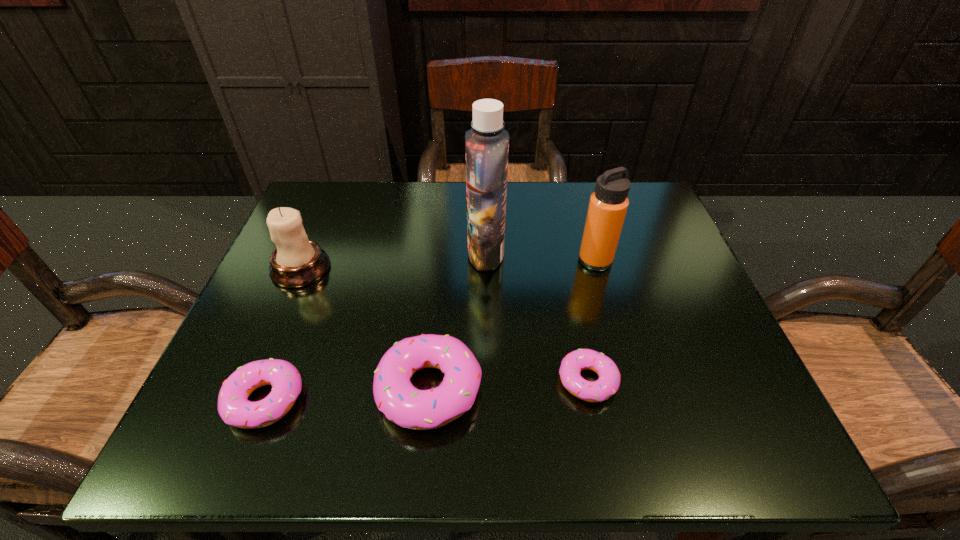
This screenshot has width=960, height=540. In order to click on free region that satisfies the following two spatial constraints: 1. on the back side of the fifth shortest object; 2. on the right side of the third shortest object in this screenshot , I will do coord(442,260).

Where is `vacant region that satisfies the following two spatial constraints: 1. on the back side of the thermos bottle; 2. on the front label of the tallest object`? vacant region that satisfies the following two spatial constraints: 1. on the back side of the thermos bottle; 2. on the front label of the tallest object is located at coordinates (593, 253).

Find the location of `free point that satisfies the following two spatial constraints: 1. on the back side of the shortest object; 2. on the front label of the tallest object`. free point that satisfies the following two spatial constraints: 1. on the back side of the shortest object; 2. on the front label of the tallest object is located at coordinates (562, 253).

Locate an element on the screen. free location that satisfies the following two spatial constraints: 1. on the front label of the tallest object; 2. on the back side of the thermos bottle is located at coordinates (486, 260).

Image resolution: width=960 pixels, height=540 pixels. What are the coordinates of `free space in the image that satisfies the following two spatial constraints: 1. on the front label of the shampoo; 2. on the left side of the fifth shortest object` in the screenshot? It's located at (486, 260).

The height and width of the screenshot is (540, 960). I want to click on vacant space that satisfies the following two spatial constraints: 1. on the front label of the shortest doughnut; 2. on the left side of the shampoo, so click(488, 381).

Image resolution: width=960 pixels, height=540 pixels. In order to click on vacant area that satisfies the following two spatial constraints: 1. on the front label of the tallest object; 2. on the left side of the shortest doughnut in this screenshot , I will do `click(488, 381)`.